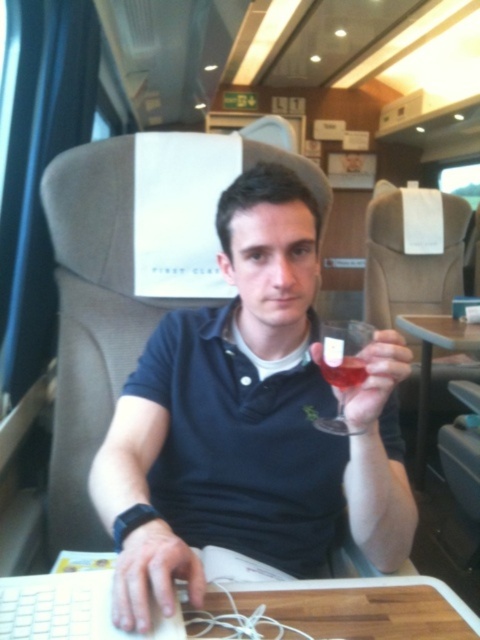
Looking at this image, measure the distance from wooden table at lower center to transparent glass at center.

11.13 inches

Between wooden table at lower center and transparent glass at center, which one is positioned lower?

wooden table at lower center is lower down.

This screenshot has width=480, height=640. I want to click on wooden table at lower center, so click(x=365, y=608).

Which is in front, point (219, 632) or point (425, 349)?

Positioned in front is point (219, 632).

Does wooden table at lower center lie in front of wooden table at center?

Yes.

Which is behind, point (96, 602) or point (409, 330)?

Point (409, 330)

I want to click on wooden table at lower center, so click(365, 608).

The image size is (480, 640). Describe the element at coordinates (250, 422) in the screenshot. I see `matte black polo shirt at center` at that location.

Does matte black polo shirt at center appear on the left side of translucent glass at center?

Correct, you'll find matte black polo shirt at center to the left of translucent glass at center.

Who is more forward, (298, 211) or (351, 380)?

Point (351, 380)

The image size is (480, 640). Identify the location of matte black polo shirt at center. (250, 422).